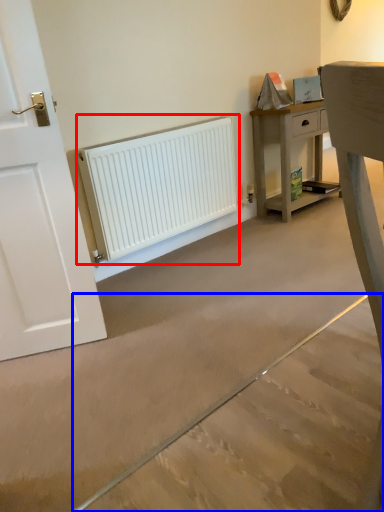
Question: Among these objects, which one is farthest to the camera, radiator (highlighted by a red box) or concrete (highlighted by a blue box)?

Choices:
 (A) radiator
 (B) concrete

Answer: (A)